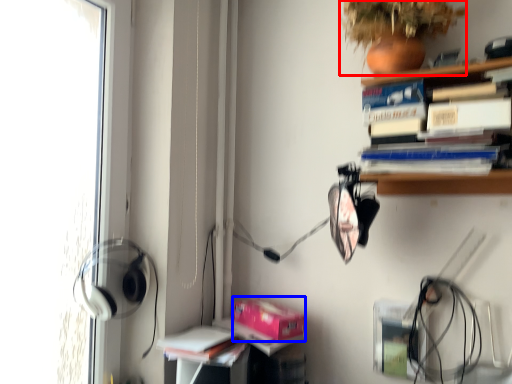
Question: Which point is further to the camera, plant (highlighted by a red box) or paperback book (highlighted by a blue box)?

Choices:
 (A) plant
 (B) paperback book

Answer: (B)